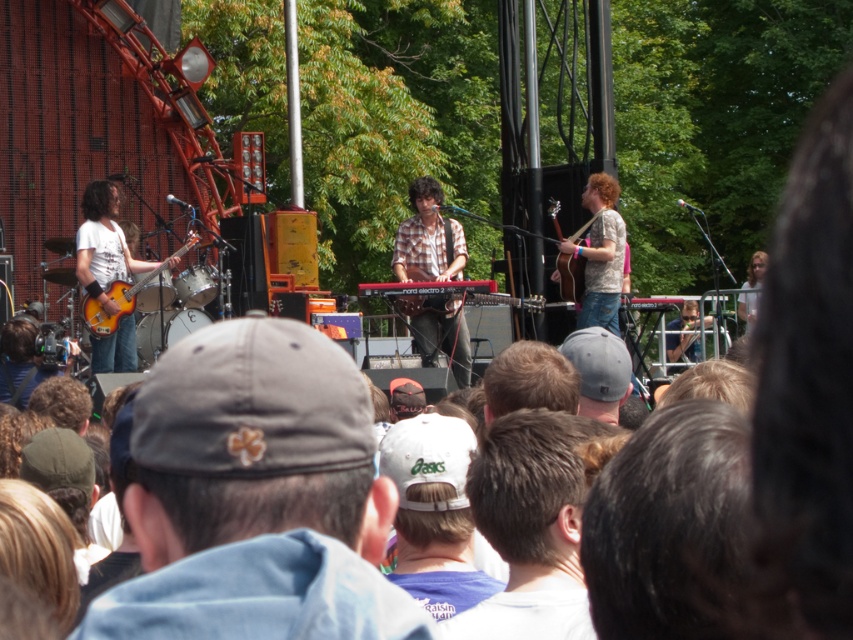
Is matte yellow guitar at left behind wooden acoustic guitar at right?

No, it is in front of wooden acoustic guitar at right.

What are the coordinates of `matte yellow guitar at left` in the screenshot? It's located at (103, 244).

Between plaid shirt at center and matte yellow guitar at left, which one has less height?

matte yellow guitar at left

Which is more to the right, plaid shirt at center or matte yellow guitar at left?

Positioned to the right is plaid shirt at center.

Which is in front, point (456, 269) or point (119, 342)?

Point (456, 269)

This screenshot has width=853, height=640. Find the location of `plaid shirt at center`. plaid shirt at center is located at coordinates click(428, 237).

Is dark brown hair at center below light brown hair at right?

Indeed, dark brown hair at center is positioned under light brown hair at right.

Who is taller, dark brown hair at center or light brown hair at right?

With more height is light brown hair at right.

What are the coordinates of `dark brown hair at center` in the screenshot? It's located at (671, 529).